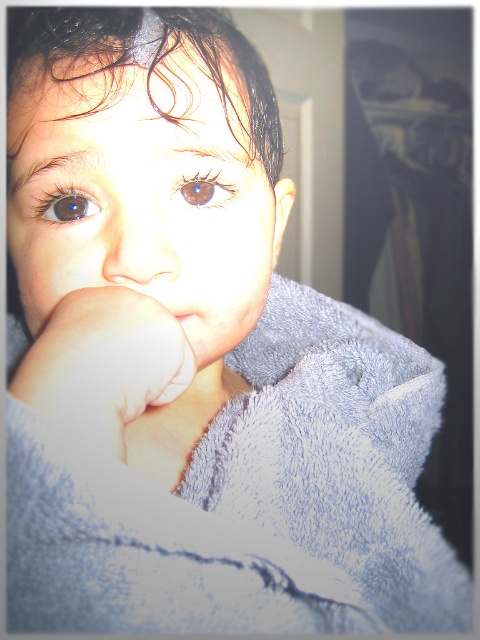
Question: Considering the real-world distances, which object is farthest from the wet dark brown hair at upper left?

Choices:
 (A) smooth flesh nose at center
 (B) smooth skin at mouth center
 (C) white soft hand at center
 (D) brown matte eye at upper left

Answer: (B)

Question: Which of these objects is positioned closest to the smooth flesh nose at center?

Choices:
 (A) wet dark brown hair at upper left
 (B) matte gray towel at center

Answer: (B)

Question: Where is smooth flesh nose at center located in relation to brown matte eye at upper left in the image?

Choices:
 (A) left
 (B) right

Answer: (B)

Question: Can you confirm if wet dark brown hair at upper left is positioned above brown matte eye at center?

Choices:
 (A) no
 (B) yes

Answer: (B)

Question: Can you confirm if brown matte eye at center is positioned to the left of brown matte eye at upper left?

Choices:
 (A) no
 (B) yes

Answer: (A)

Question: Which object is positioned closest to the white soft hand at center?

Choices:
 (A) smooth flesh nose at center
 (B) brown matte eye at center

Answer: (A)